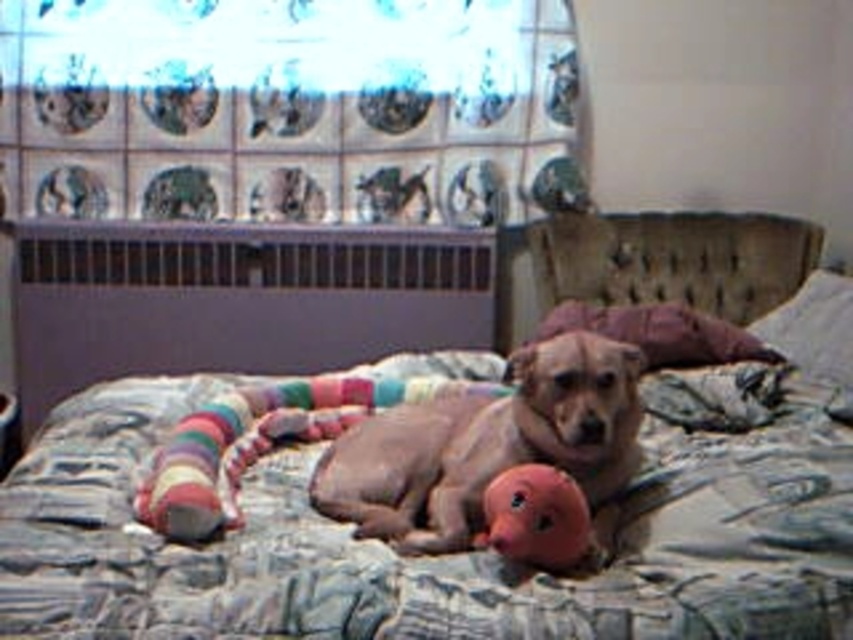
Question: Which point appears farthest from the camera in this image?

Choices:
 (A) (813, 308)
 (B) (698, 243)

Answer: (B)

Question: Is brown matte dog at center below purple fabric pillow at upper right?

Choices:
 (A) no
 (B) yes

Answer: (B)

Question: Is brown matte dog at center in front of purple fabric pillow at center?

Choices:
 (A) no
 (B) yes

Answer: (B)

Question: Which of the following is the farthest from the observer?

Choices:
 (A) purple fabric pillow at center
 (B) pink rubber duck at center

Answer: (A)

Question: Does purple fabric pillow at center appear on the left side of pink rubber duck at center?

Choices:
 (A) no
 (B) yes

Answer: (A)

Question: Estimate the real-world distances between objects in this image. Which object is closer to the brown matte dog at center?

Choices:
 (A) purple fabric pillow at center
 (B) textured fabric bed at center

Answer: (B)